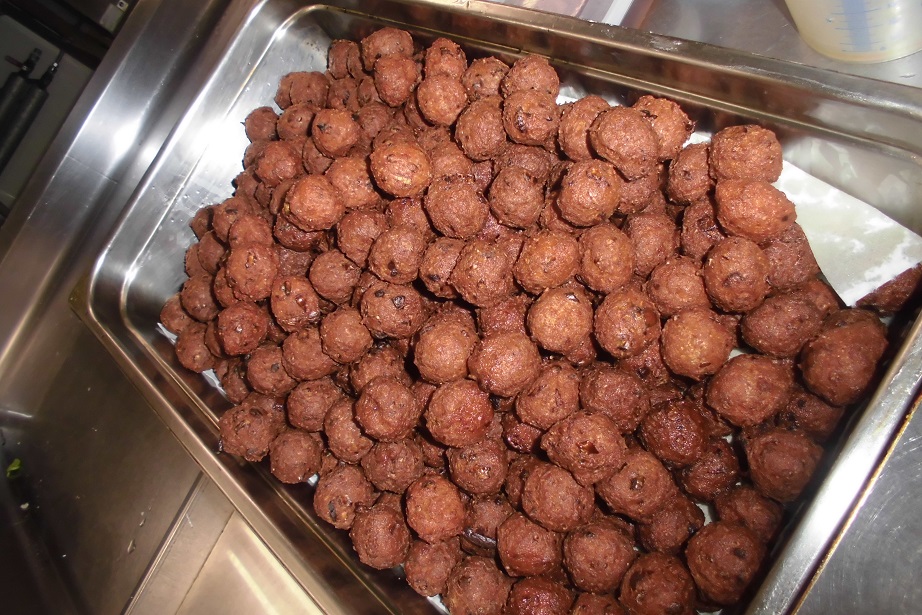
The width and height of the screenshot is (922, 615). I want to click on parchment paper under pastries, so pyautogui.click(x=860, y=271).